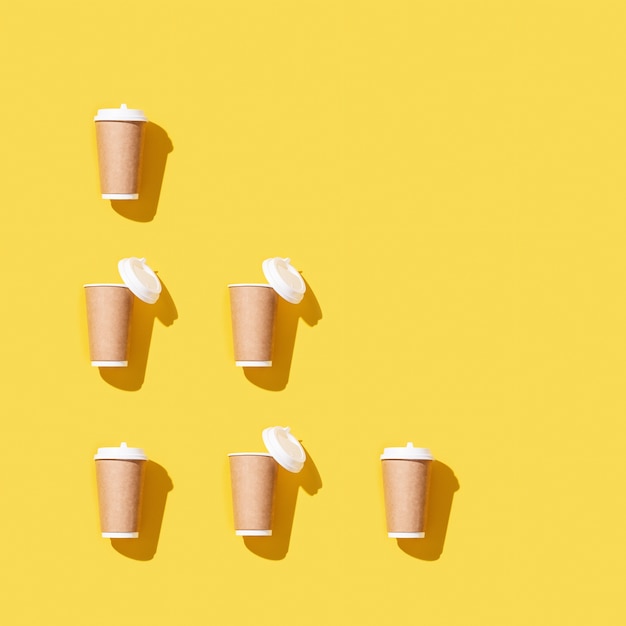
Where is `paper cups`? The width and height of the screenshot is (626, 626). paper cups is located at coordinates (408, 498), (250, 495), (116, 500), (258, 314), (111, 314), (120, 150).